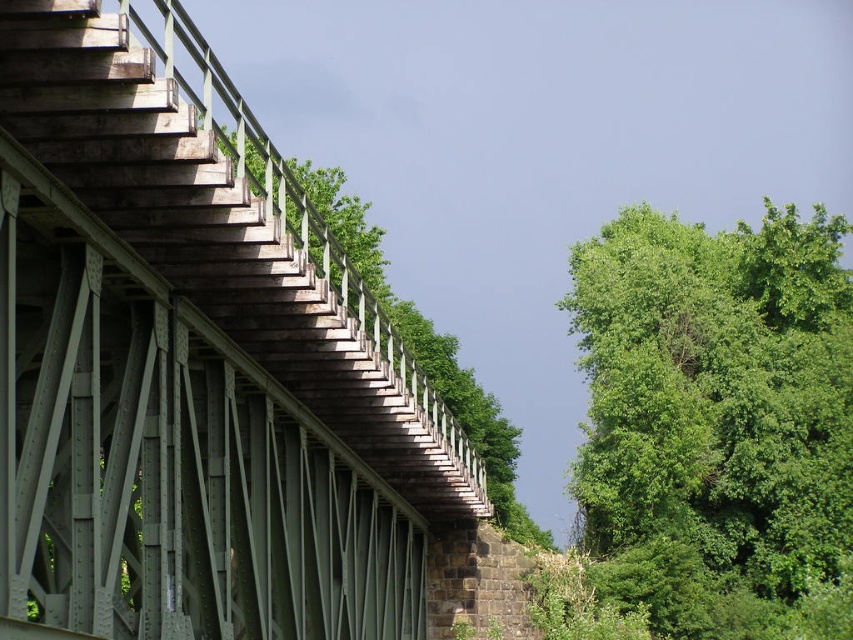
Question: Which object appears closest to the camera in this image?

Choices:
 (A) green leafy tree at right
 (B) green metallic bridge at left

Answer: (B)

Question: Can you confirm if green metallic bridge at left is smaller than green leafy tree at right?

Choices:
 (A) no
 (B) yes

Answer: (A)

Question: Which point appears closest to the camera in this image?

Choices:
 (A) (x=595, y=442)
 (B) (x=242, y=621)

Answer: (B)

Question: From the image, what is the correct spatial relationship of green metallic bridge at left in relation to green leafy tree at right?

Choices:
 (A) above
 (B) below

Answer: (A)

Question: Is green metallic bridge at left closer to camera compared to green leafy tree at right?

Choices:
 (A) no
 (B) yes

Answer: (B)